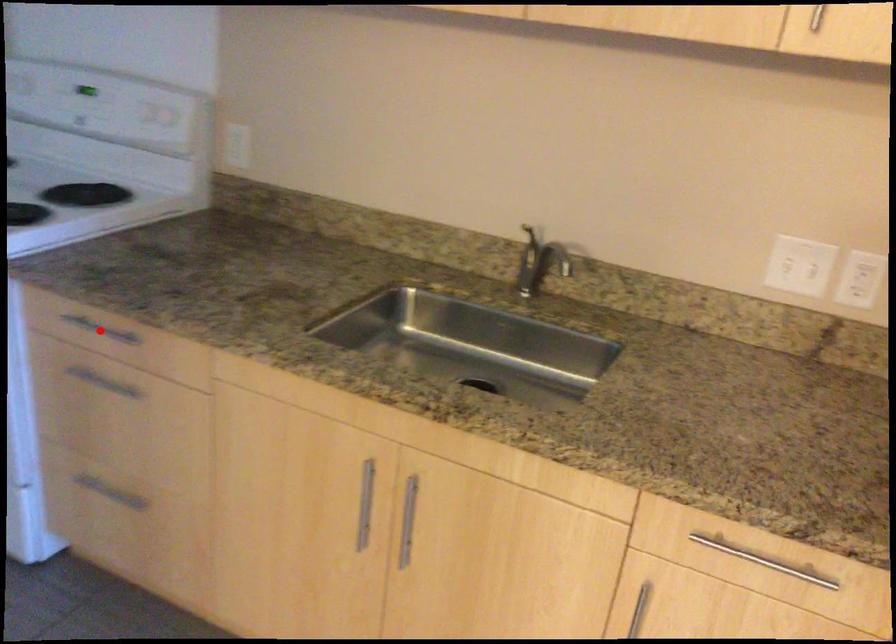
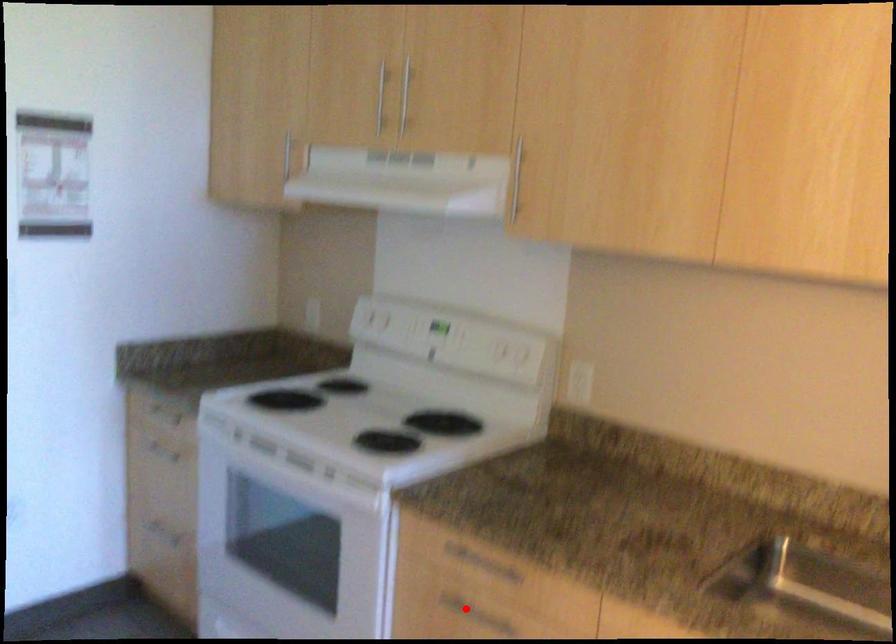
I am providing you with two images of the same scene from different viewpoints. A red point is marked on the first image and another point is marked on the second image. Do the highlighted points in image1 and image2 indicate the same real-world spot?

No